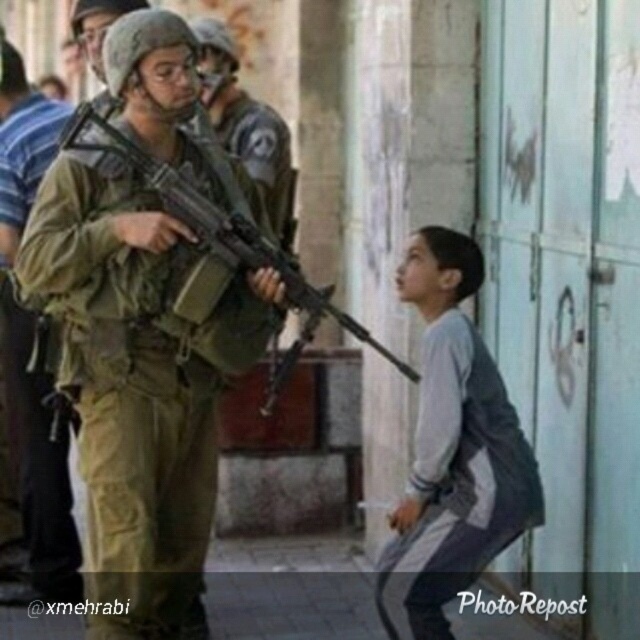
Is camouflage fabric uniform at left positioned behind camouflage uniform at center?

That is False.

Consider the image. Between camouflage fabric uniform at left and camouflage uniform at center, which one appears on the left side from the viewer's perspective?

camouflage uniform at center is more to the left.

This screenshot has width=640, height=640. I want to click on camouflage fabric uniform at left, so click(138, 376).

You are a GUI agent. You are given a task and a screenshot of the screen. Output one action in this format:
    pyautogui.click(x=<x>, y=<y>)
    Task: Click on the camouflage fabric uniform at left
    This screenshot has width=640, height=640.
    Given the screenshot: What is the action you would take?
    pyautogui.click(x=138, y=376)

Is camouflage fabric uniform at left wider than matte black rifle at center?

No.

Between point (170, 36) and point (243, 257), which one is positioned behind?

The point (243, 257) is more distant.

Find the location of a particular element. The height and width of the screenshot is (640, 640). camouflage fabric uniform at left is located at coordinates (138, 376).

How far apart are camouflage fabric uniform at left and gray fabric pants at lower right?

They are 5.77 feet apart.

Between camouflage fabric uniform at left and gray fabric pants at lower right, which one is positioned higher?

camouflage fabric uniform at left

Between point (209, 472) and point (449, 406), which one is positioned in front?

Point (449, 406) is in front.

You are a GUI agent. You are given a task and a screenshot of the screen. Output one action in this format:
    pyautogui.click(x=<x>, y=<y>)
    Task: Click on the camouflage fabric uniform at left
    The height and width of the screenshot is (640, 640).
    Given the screenshot: What is the action you would take?
    pyautogui.click(x=138, y=376)